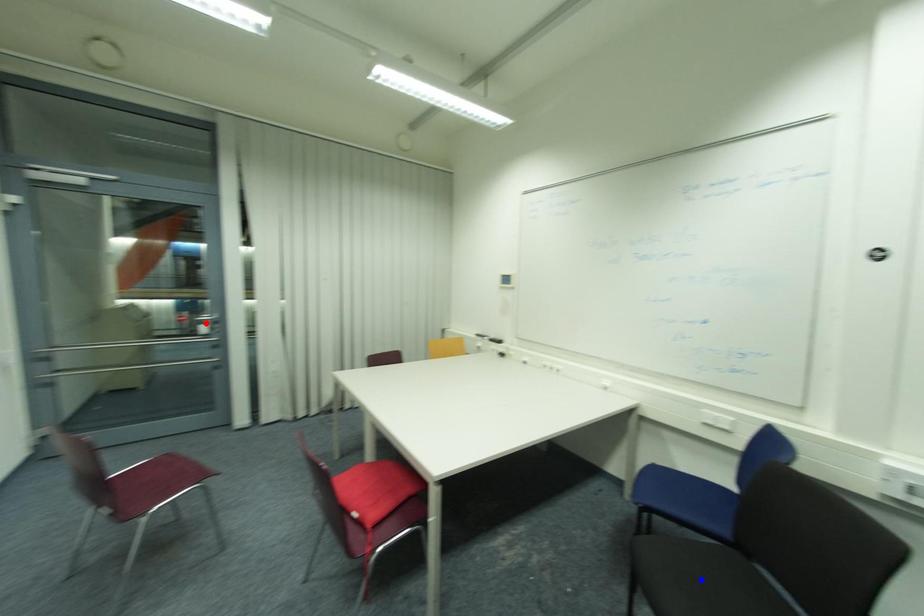
Question: In the image, two points are highlighted. Which point is nearer to the camera? Reply with the corresponding letter.

Choices:
 (A) blue point
 (B) red point

Answer: (A)